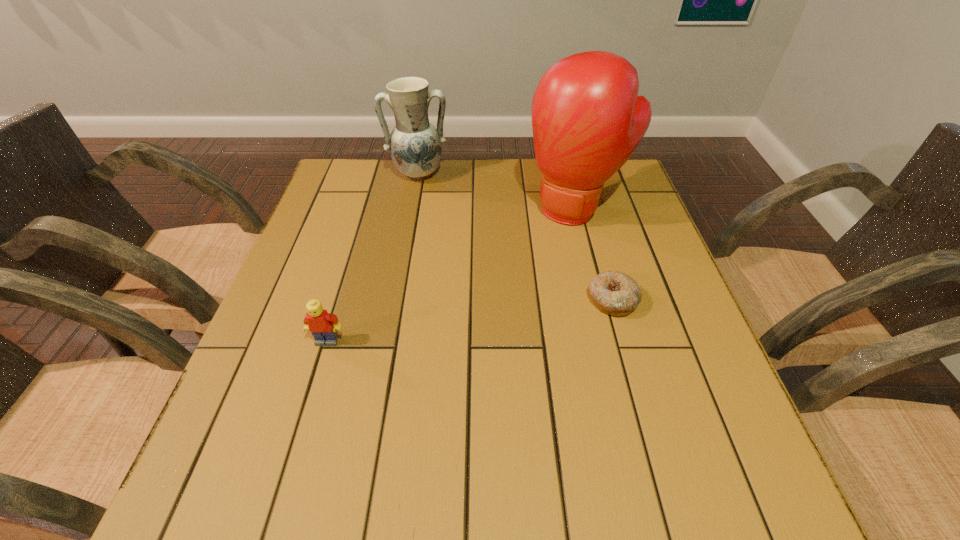
Identify the location of Lego. The width and height of the screenshot is (960, 540). (322, 325).

The width and height of the screenshot is (960, 540). What are the coordinates of `the second shortest object` in the screenshot? It's located at (322, 325).

This screenshot has width=960, height=540. In order to click on the shortest object in this screenshot , I will do `click(615, 293)`.

Find the location of a particular element. The width and height of the screenshot is (960, 540). doughnut is located at coordinates (615, 293).

Where is `the tallest object`? the tallest object is located at coordinates (587, 118).

The width and height of the screenshot is (960, 540). I want to click on pottery, so click(x=415, y=145).

At what (x,y) coordinates should I click in order to perform the action: click on free space located on the front-facing side of the Lego. Please return your answer as a coordinate pair (x, y). Looking at the image, I should click on (315, 382).

Find the location of a particular element. The image size is (960, 540). blank space located 0.260m on the front of the doughnut is located at coordinates (652, 439).

Locate an element on the screen. free point located 0.290m on the striking surface of the tallest object is located at coordinates (507, 310).

Locate an element on the screen. Image resolution: width=960 pixels, height=540 pixels. vacant space located 0.320m on the striking surface of the tallest object is located at coordinates (501, 320).